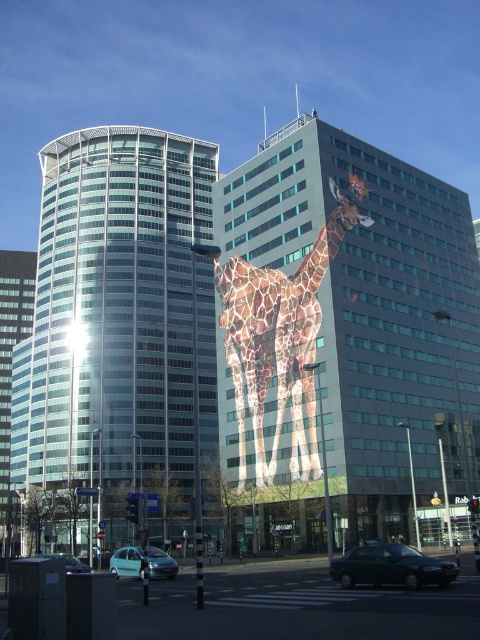
You are standing at the point indicated by point (391, 566) in the image. Looking around, you see the two buildings described. Which direction should you face to look towards the metallic dark green car at lower center?

The point (391, 566) is the location of the metallic dark green car at lower center, so you are already facing it.